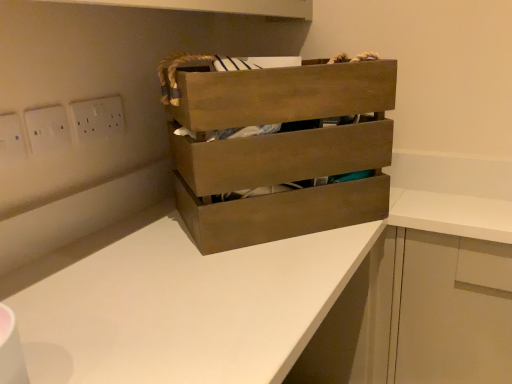
This screenshot has height=384, width=512. In order to click on blank space situated above white matte counter at center (from a real-world perspective) in this screenshot , I will do `click(187, 263)`.